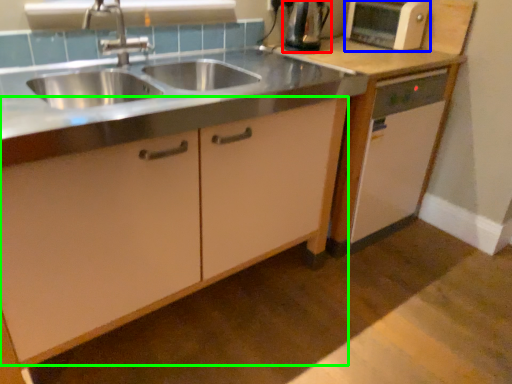
Question: Which object is positioned farthest from kitchen appliance (highlighted by a red box)? Select from home appliance (highlighted by a blue box) and cabinetry (highlighted by a green box).

Choices:
 (A) home appliance
 (B) cabinetry

Answer: (B)